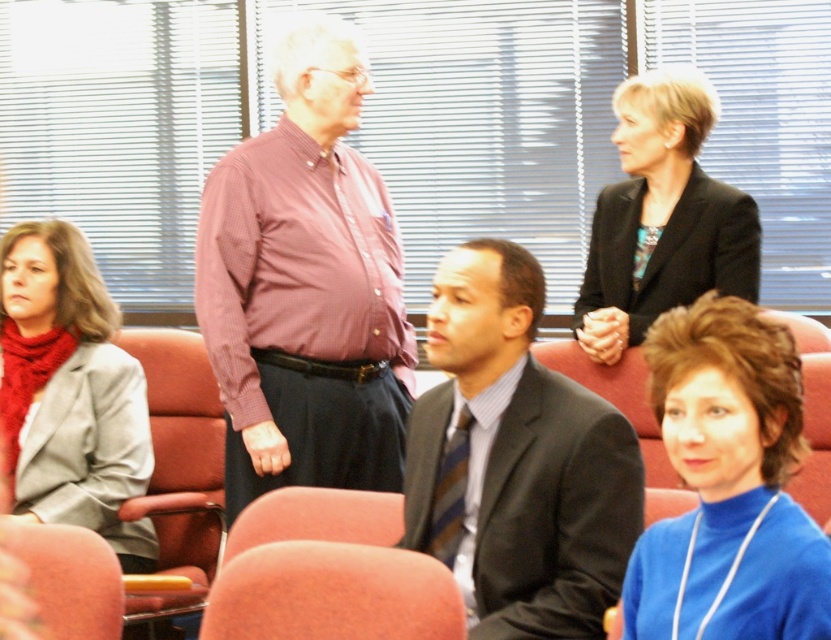
Question: Among these objects, which one is nearest to the camera?

Choices:
 (A) matte pink shirt at center
 (B) orange fabric chair at lower center
 (C) velvet-like pink chair at lower left
 (D) dark gray suit at center

Answer: (B)

Question: Which point is closer to the camera?

Choices:
 (A) (382, 218)
 (B) (60, 416)
 (C) (214, 451)

Answer: (B)

Question: Is dark gray suit at center above velvet-like pink chair at lower left?

Choices:
 (A) no
 (B) yes

Answer: (B)

Question: Where is blue turtleneck sweater at lower right located in relation to black matte blazer at upper right in the image?

Choices:
 (A) right
 (B) left

Answer: (B)

Question: Considering the relative positions of dark gray suit at center and leather seat at center in the image provided, where is dark gray suit at center located with respect to leather seat at center?

Choices:
 (A) left
 (B) right

Answer: (B)

Question: Which is farther from the leather seat at center?

Choices:
 (A) dark gray suit at center
 (B) gray wool blazer at left
 (C) black matte blazer at upper right
 (D) matte pink shirt at center

Answer: (C)